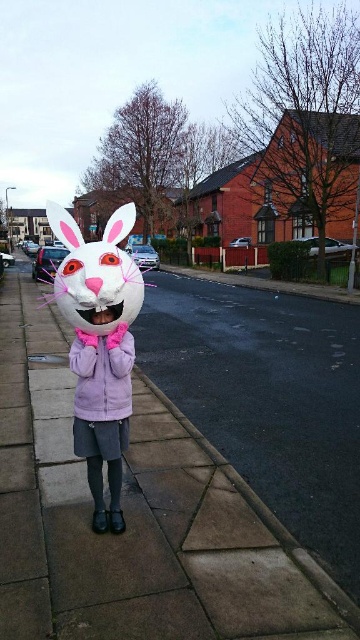
You are a costume designer preparing for a Halloween party. You need to ensure that the matte white bunny mask at center and the purple fleece jacket at center are proportionally sized for a character. Based on the image, which object is larger?

The matte white bunny mask at center is larger compared to the purple fleece jacket at center.

You are a photographer trying to capture the white matte bunny at center and the purple fleece jacket at center in a single frame. Since you want both subjects to be visible, which one should you position closer to the left side of your camera viewfinder?

The white matte bunny at center should be positioned closer to the left side of the camera viewfinder because it is already located to the left of the purple fleece jacket at center in the scene.

You are a photographer trying to capture a closeup of the white matte bunny at center and the purple fleece jacket at center. You want to ensure both are fully visible in the frame. Which object should you zoom out slightly to include in the shot?

Since the white matte bunny at center is wider than the purple fleece jacket at center, you should zoom out slightly to include the white matte bunny at center in the frame.